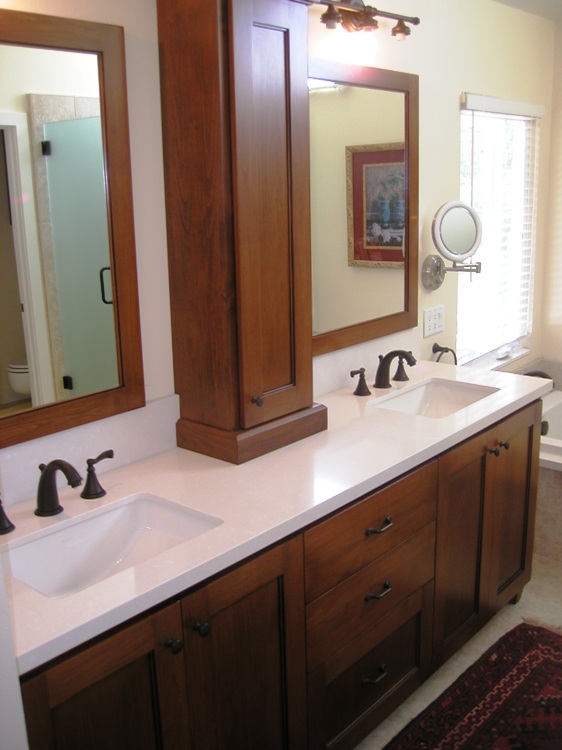
Where is `window`? The width and height of the screenshot is (562, 750). window is located at coordinates (513, 236).